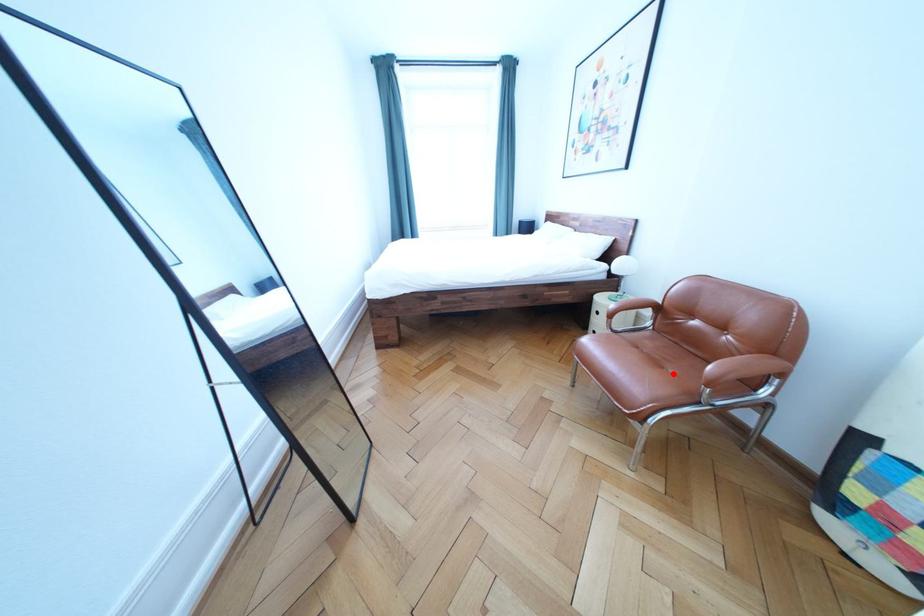
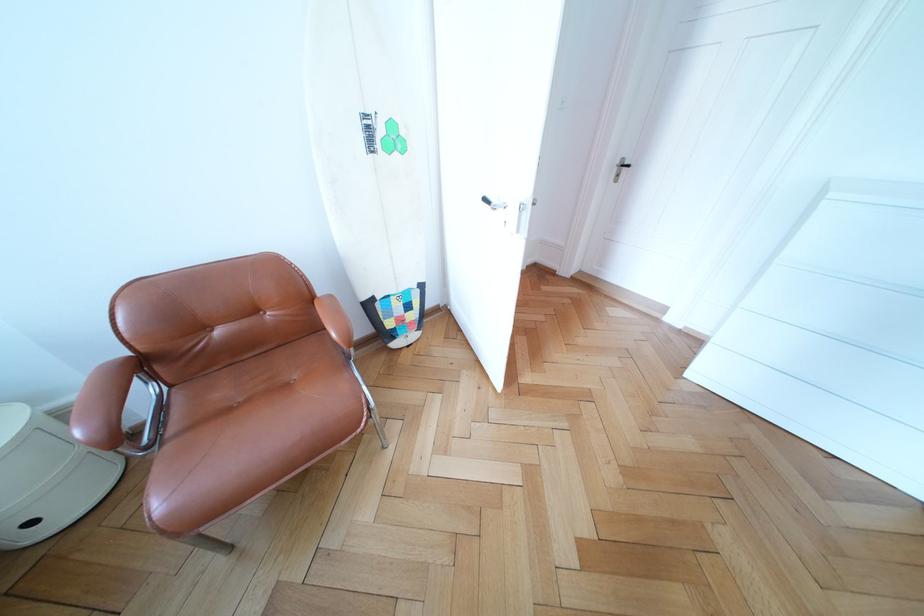
Find the pixel in the second image that matches the highlighted location in the first image.

(298, 391)